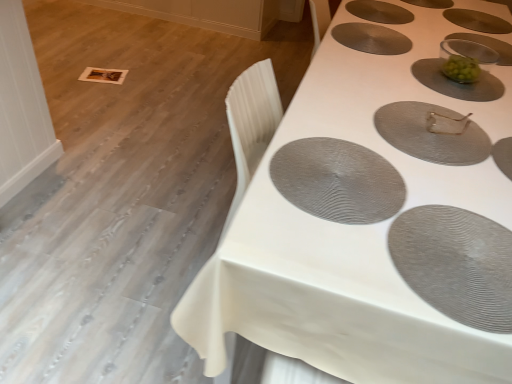
Question: Is clear glass bowl at upper right outside matte gray placemat at center, placed as the third oval when sorted from front to back?

Choices:
 (A) yes
 (B) no

Answer: (A)

Question: From the image's perspective, is clear glass bowl at upper right under matte gray placemat at center, placed as the third oval when sorted from front to back?

Choices:
 (A) no
 (B) yes

Answer: (A)

Question: Considering the relative positions of clear glass bowl at upper right and matte gray placemat at center, which is the fifth oval in back-to-front order, in the image provided, is clear glass bowl at upper right to the right of matte gray placemat at center, which is the fifth oval in back-to-front order, from the viewer's perspective?

Choices:
 (A) yes
 (B) no

Answer: (A)

Question: Is clear glass bowl at upper right positioned before matte gray placemat at center, which is the fifth oval in back-to-front order?

Choices:
 (A) no
 (B) yes

Answer: (A)

Question: Does clear glass bowl at upper right lie behind matte gray placemat at center, placed as the third oval when sorted from front to back?

Choices:
 (A) no
 (B) yes

Answer: (B)

Question: Does clear glass bowl at upper right have a greater width compared to matte gray placemat at center, placed as the third oval when sorted from front to back?

Choices:
 (A) yes
 (B) no

Answer: (B)

Question: From a real-world perspective, does green matte bowl at upper right, which is the fourth oval from back to front, sit lower than matte gray placemat at upper center, positioned as the fifth oval in front-to-back order?

Choices:
 (A) no
 (B) yes

Answer: (A)

Question: Is matte gray placemat at upper center, arranged as the third oval when viewed from the back, surrounded by green matte bowl at upper right, which is the fourth oval from back to front?

Choices:
 (A) yes
 (B) no

Answer: (B)

Question: Can you confirm if green matte bowl at upper right, which is the fourth oval from back to front, is shorter than matte gray placemat at upper center, positioned as the fifth oval in front-to-back order?

Choices:
 (A) yes
 (B) no

Answer: (B)

Question: Can you see green matte bowl at upper right, the 4th oval from the front, touching matte gray placemat at upper center, positioned as the fifth oval in front-to-back order?

Choices:
 (A) no
 (B) yes

Answer: (A)

Question: Is green matte bowl at upper right, the 4th oval from the front, to the left of matte gray placemat at upper center, arranged as the third oval when viewed from the back, from the viewer's perspective?

Choices:
 (A) no
 (B) yes

Answer: (A)

Question: Is green matte bowl at upper right, the 4th oval from the front, looking in the opposite direction of matte gray placemat at upper center, arranged as the third oval when viewed from the back?

Choices:
 (A) no
 (B) yes

Answer: (A)

Question: From the image's perspective, does matte gray placemat at upper right, which is the 7th oval from front to back, appear lower than green matte bowl at upper right, which is the fourth oval from back to front?

Choices:
 (A) no
 (B) yes

Answer: (A)